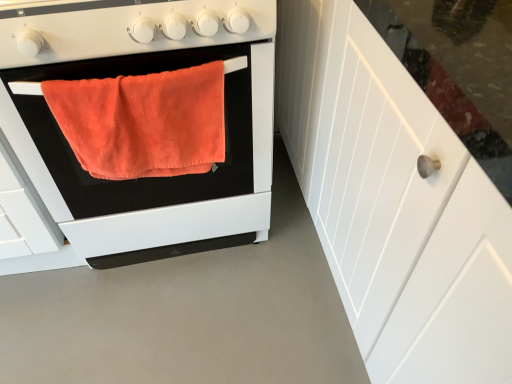
Question: From a real-world perspective, is white wood cabinet at right below orange fabric towel at left?

Choices:
 (A) no
 (B) yes

Answer: (A)

Question: Considering the relative sizes of white wood cabinet at right and orange fabric towel at left in the image provided, is white wood cabinet at right bigger than orange fabric towel at left?

Choices:
 (A) no
 (B) yes

Answer: (B)

Question: Is white wood cabinet at right not inside orange fabric towel at left?

Choices:
 (A) yes
 (B) no

Answer: (A)

Question: Is white wood cabinet at right thinner than orange fabric towel at left?

Choices:
 (A) yes
 (B) no

Answer: (A)

Question: Is orange fabric towel at left located within white wood cabinet at right?

Choices:
 (A) yes
 (B) no

Answer: (B)

Question: Considering the relative sizes of white wood cabinet at right and orange fabric towel at left in the image provided, is white wood cabinet at right wider than orange fabric towel at left?

Choices:
 (A) no
 (B) yes

Answer: (A)

Question: Considering the relative sizes of matte white gas stove at center and orange fabric towel at left in the image provided, is matte white gas stove at center shorter than orange fabric towel at left?

Choices:
 (A) no
 (B) yes

Answer: (B)

Question: Is orange fabric towel at left surrounded by matte white gas stove at center?

Choices:
 (A) no
 (B) yes

Answer: (A)

Question: Considering the relative sizes of matte white gas stove at center and orange fabric towel at left in the image provided, is matte white gas stove at center bigger than orange fabric towel at left?

Choices:
 (A) yes
 (B) no

Answer: (B)

Question: Is matte white gas stove at center aimed at orange fabric towel at left?

Choices:
 (A) no
 (B) yes

Answer: (A)

Question: Is matte white gas stove at center located outside orange fabric towel at left?

Choices:
 (A) yes
 (B) no

Answer: (A)

Question: Considering the relative positions of matte white gas stove at center and orange fabric towel at left in the image provided, is matte white gas stove at center to the right of orange fabric towel at left from the viewer's perspective?

Choices:
 (A) no
 (B) yes

Answer: (B)

Question: Is white wood cabinet at right a part of orange plush towel at center?

Choices:
 (A) no
 (B) yes

Answer: (A)